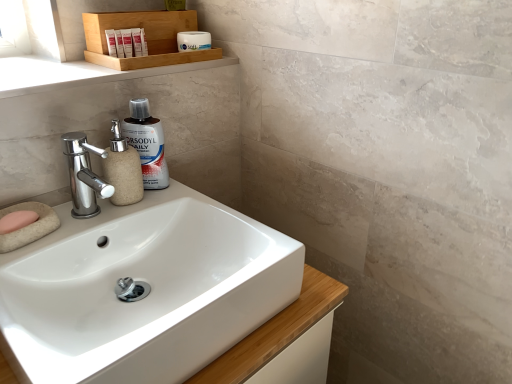
What are the coordinates of `free spot in front of matte white tube at upper left, marked as the third toiletry in a back-to-front arrangement` in the screenshot? It's located at (78, 73).